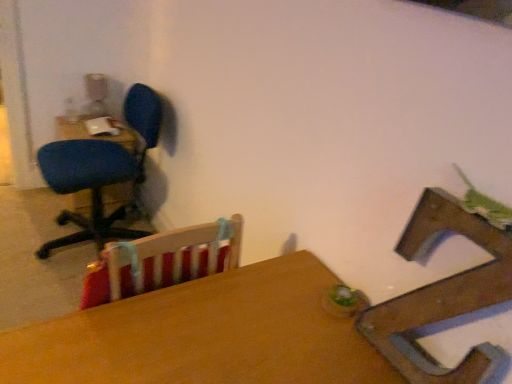
Identify the location of free space above wooden table at center, marked as the 1th table in a bottom-to-top arrangement (from a real-world perspective). The height and width of the screenshot is (384, 512). (229, 332).